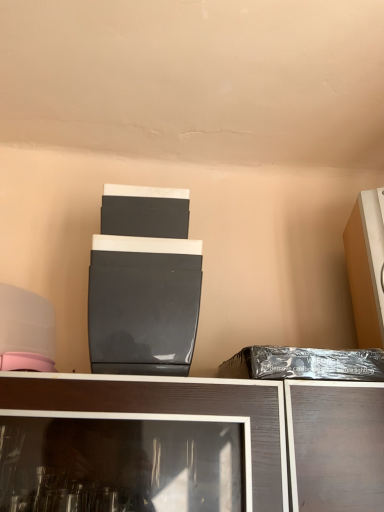
Question: Is matte orange cabinet at right, the 2th appliance positioned from the left, next to black plastic bag at right and touching it?

Choices:
 (A) yes
 (B) no

Answer: (B)

Question: Is matte orange cabinet at right, the 2th appliance positioned from the left, not inside black plastic bag at right?

Choices:
 (A) no
 (B) yes

Answer: (B)

Question: From a real-world perspective, is matte orange cabinet at right, which ranks as the first appliance in right-to-left order, over black plastic bag at right?

Choices:
 (A) no
 (B) yes

Answer: (B)

Question: Is matte orange cabinet at right, the 2th appliance positioned from the left, oriented towards black plastic bag at right?

Choices:
 (A) yes
 (B) no

Answer: (B)

Question: Is the depth of matte orange cabinet at right, the 2th appliance positioned from the left, less than that of black plastic bag at right?

Choices:
 (A) no
 (B) yes

Answer: (A)

Question: Does matte orange cabinet at right, the 2th appliance positioned from the left, have a larger size compared to black plastic bag at right?

Choices:
 (A) yes
 (B) no

Answer: (A)

Question: Is black plastic bag at right oriented towards matte black appliance at center, which is counted as the second appliance, starting from the right?

Choices:
 (A) yes
 (B) no

Answer: (B)

Question: Is matte black appliance at center, arranged as the 1th appliance when viewed from the left, at the back of black plastic bag at right?

Choices:
 (A) no
 (B) yes

Answer: (A)

Question: Considering the relative sizes of black plastic bag at right and matte black appliance at center, arranged as the 1th appliance when viewed from the left, in the image provided, is black plastic bag at right thinner than matte black appliance at center, arranged as the 1th appliance when viewed from the left,?

Choices:
 (A) no
 (B) yes

Answer: (B)

Question: From the image's perspective, is black plastic bag at right below matte black appliance at center, arranged as the 1th appliance when viewed from the left?

Choices:
 (A) yes
 (B) no

Answer: (A)

Question: Does black plastic bag at right have a greater width compared to matte black appliance at center, which is counted as the second appliance, starting from the right?

Choices:
 (A) no
 (B) yes

Answer: (A)

Question: From a real-world perspective, does black plastic bag at right stand above matte black appliance at center, arranged as the 1th appliance when viewed from the left?

Choices:
 (A) yes
 (B) no

Answer: (B)

Question: From a real-world perspective, does matte black appliance at center, arranged as the 1th appliance when viewed from the left, sit lower than black plastic bag at right?

Choices:
 (A) no
 (B) yes

Answer: (A)